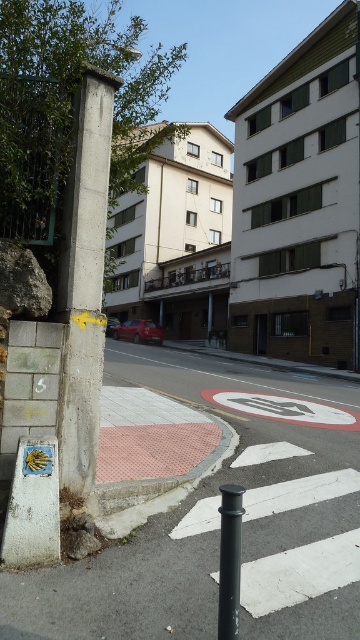
Is concrete pole at center smaller than black metal pole at lower center?

Incorrect, concrete pole at center is not smaller in size than black metal pole at lower center.

Is point (72, 273) positioned after point (231, 630)?

That is True.

Which is in front, point (77, 225) or point (223, 522)?

Positioned in front is point (223, 522).

You are a GUI agent. You are given a task and a screenshot of the screen. Output one action in this format:
    pyautogui.click(x=<x>, y=<y>)
    Task: Click on the concrete pole at center
    Image resolution: width=360 pixels, height=640 pixels.
    Given the screenshot: What is the action you would take?
    pyautogui.click(x=83, y=282)